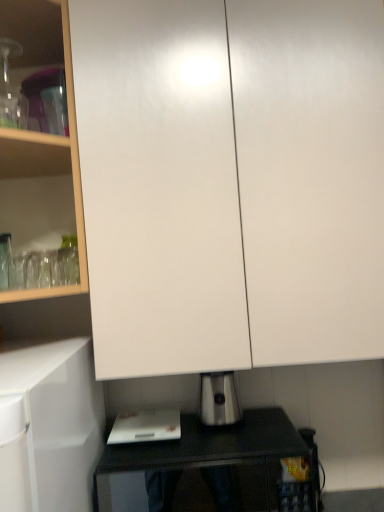
Locate an element on the screen. The height and width of the screenshot is (512, 384). vacant region above white plastic cutting board at lower center (from a real-world perspective) is located at coordinates (147, 415).